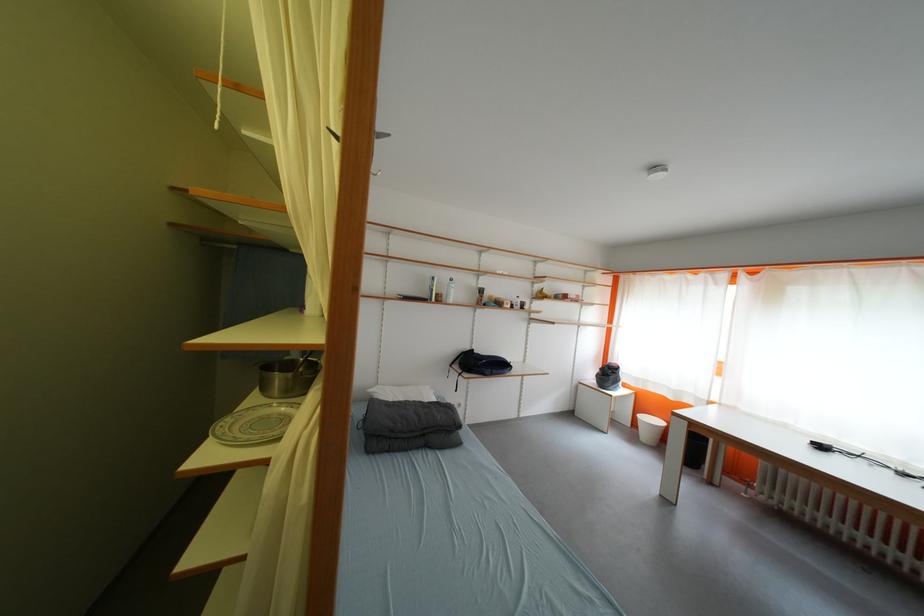
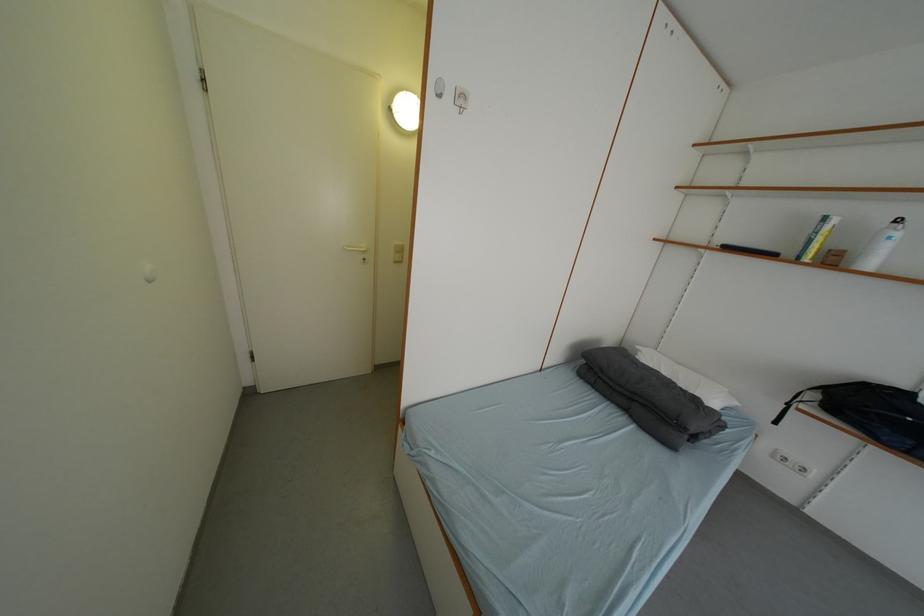
Question: Based on the continuous images, in which direction is the camera rotating? Reply with the corresponding letter.

Choices:
 (A) Left
 (B) Right
 (C) Up
 (D) Down

Answer: (A)